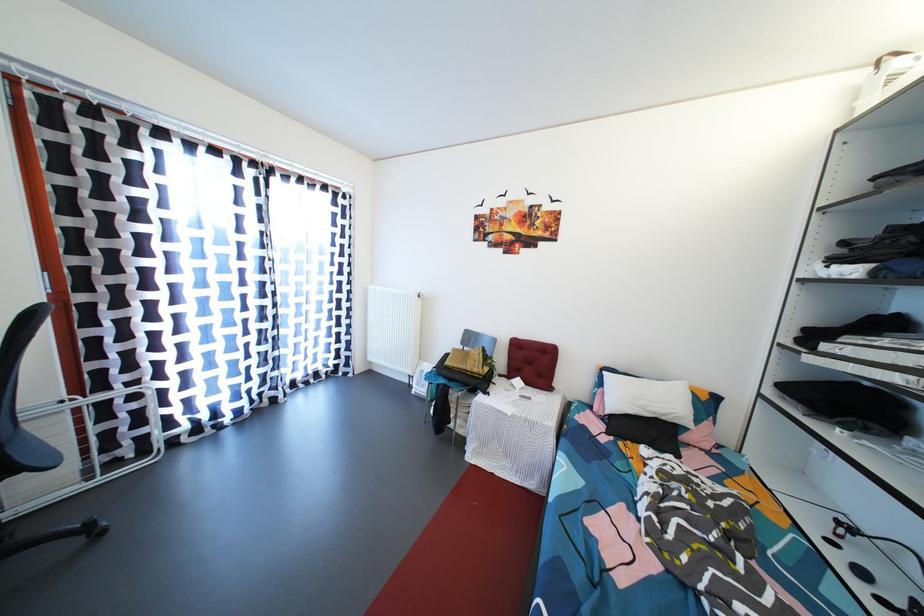
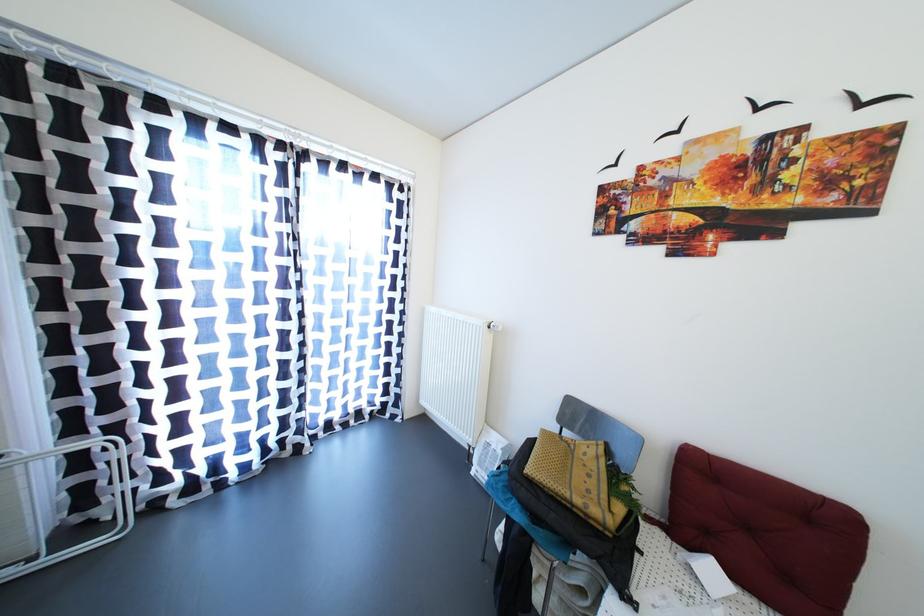
Locate, in the second image, the point that corresponds to point 515,377 in the first image.

(677, 525)